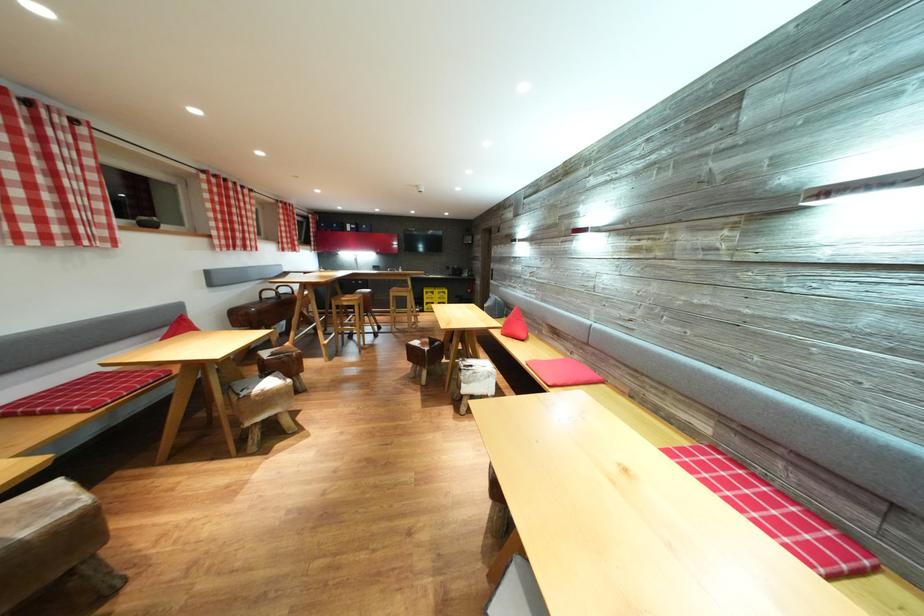
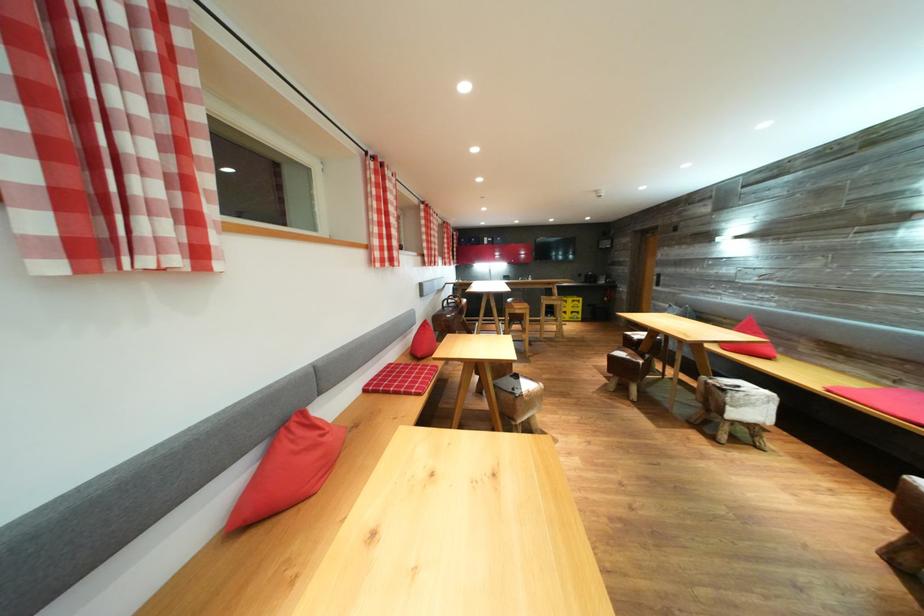
In the second image, find the point that corresponds to [254,402] in the first image.

(528, 400)